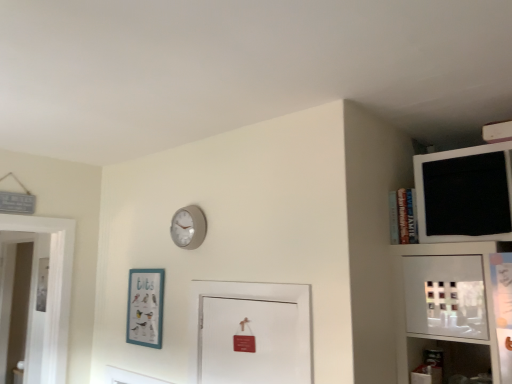
Question: Considering the relative positions of matte gray clock at upper center and teal matte picture frame at lower left in the image provided, is matte gray clock at upper center in front of teal matte picture frame at lower left?

Choices:
 (A) yes
 (B) no

Answer: (A)

Question: Does matte gray clock at upper center have a lesser width compared to teal matte picture frame at lower left?

Choices:
 (A) yes
 (B) no

Answer: (B)

Question: Is matte gray clock at upper center to the left of teal matte picture frame at lower left from the viewer's perspective?

Choices:
 (A) no
 (B) yes

Answer: (A)

Question: Does matte gray clock at upper center lie behind teal matte picture frame at lower left?

Choices:
 (A) yes
 (B) no

Answer: (B)

Question: Does matte gray clock at upper center appear on the right side of teal matte picture frame at lower left?

Choices:
 (A) yes
 (B) no

Answer: (A)

Question: From the image's perspective, is teal matte picture frame at lower left positioned above or below matte gray clock at upper center?

Choices:
 (A) above
 (B) below

Answer: (B)

Question: Would you say teal matte picture frame at lower left is inside or outside matte gray clock at upper center?

Choices:
 (A) inside
 (B) outside

Answer: (B)

Question: Would you say teal matte picture frame at lower left is to the left or to the right of matte gray clock at upper center in the picture?

Choices:
 (A) right
 (B) left

Answer: (B)

Question: Relative to matte gray clock at upper center, is teal matte picture frame at lower left in front or behind?

Choices:
 (A) behind
 (B) front

Answer: (A)

Question: From the image's perspective, is black matte medicine cabinet at upper right positioned above or below teal matte picture frame at lower left?

Choices:
 (A) above
 (B) below

Answer: (A)

Question: Is black matte medicine cabinet at upper right taller or shorter than teal matte picture frame at lower left?

Choices:
 (A) short
 (B) tall

Answer: (A)

Question: Considering the positions of point (466, 168) and point (137, 304), is point (466, 168) closer or farther from the camera than point (137, 304)?

Choices:
 (A) farther
 (B) closer

Answer: (B)

Question: From a real-world perspective, is black matte medicine cabinet at upper right above or below teal matte picture frame at lower left?

Choices:
 (A) above
 (B) below

Answer: (A)

Question: From a real-world perspective, relative to black matte medicine cabinet at upper right, is matte gray clock at upper center vertically above or below?

Choices:
 (A) below
 (B) above

Answer: (A)

Question: In the image, is matte gray clock at upper center on the left side or the right side of black matte medicine cabinet at upper right?

Choices:
 (A) right
 (B) left

Answer: (B)